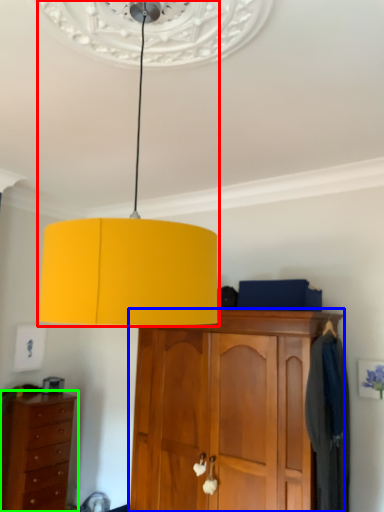
Question: Considering the real-world distances, which object is farthest from lamp (highlighted by a red box)? cabinetry (highlighted by a blue box) or chest of drawers (highlighted by a green box)?

Choices:
 (A) cabinetry
 (B) chest of drawers

Answer: (B)